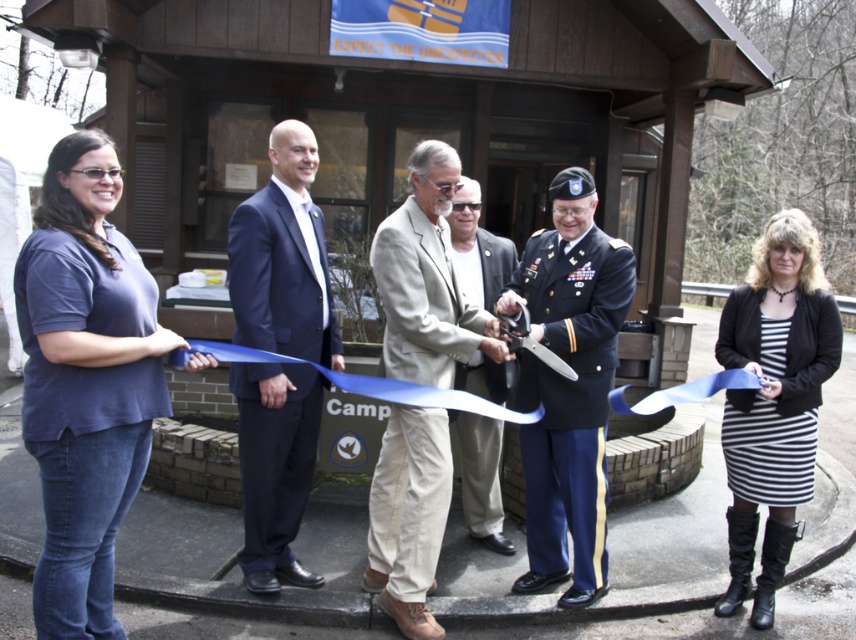
What is the color of the suit worn by the person standing at the coordinate point [283,259] in the image?

The point [283,259] corresponds to the navy blue suit at center, so the color of the suit is navy blue.